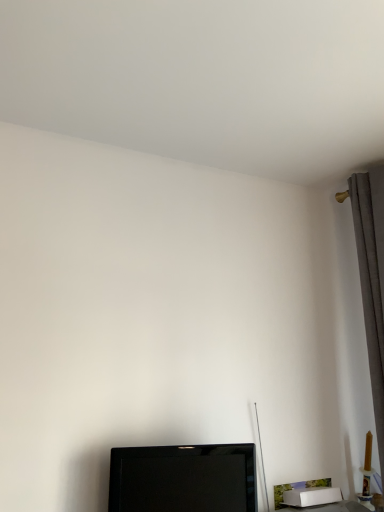
Question: Does black glossy tv at lower center come behind gray fabric curtain at right?

Choices:
 (A) yes
 (B) no

Answer: (B)

Question: Is gray fabric curtain at right at the back of black glossy tv at lower center?

Choices:
 (A) yes
 (B) no

Answer: (B)

Question: Is black glossy tv at lower center facing towards gray fabric curtain at right?

Choices:
 (A) yes
 (B) no

Answer: (B)

Question: Is there a large distance between black glossy tv at lower center and gray fabric curtain at right?

Choices:
 (A) yes
 (B) no

Answer: (B)

Question: From the image's perspective, would you say black glossy tv at lower center is shown under gray fabric curtain at right?

Choices:
 (A) no
 (B) yes

Answer: (B)

Question: Can you confirm if black glossy tv at lower center is positioned to the left of gray fabric curtain at right?

Choices:
 (A) no
 (B) yes

Answer: (B)

Question: Is gray fabric curtain at right wider than black glossy tv at lower center?

Choices:
 (A) no
 (B) yes

Answer: (B)

Question: Is gray fabric curtain at right positioned with its back to black glossy tv at lower center?

Choices:
 (A) yes
 (B) no

Answer: (B)

Question: Is gray fabric curtain at right aimed at black glossy tv at lower center?

Choices:
 (A) yes
 (B) no

Answer: (A)

Question: Considering the relative sizes of gray fabric curtain at right and black glossy tv at lower center in the image provided, is gray fabric curtain at right taller than black glossy tv at lower center?

Choices:
 (A) yes
 (B) no

Answer: (A)

Question: Is gray fabric curtain at right smaller than black glossy tv at lower center?

Choices:
 (A) no
 (B) yes

Answer: (A)

Question: Considering the relative sizes of gray fabric curtain at right and black glossy tv at lower center in the image provided, is gray fabric curtain at right thinner than black glossy tv at lower center?

Choices:
 (A) no
 (B) yes

Answer: (A)

Question: Choose the correct answer: Is black glossy tv at lower center inside gray fabric curtain at right or outside it?

Choices:
 (A) outside
 (B) inside

Answer: (A)